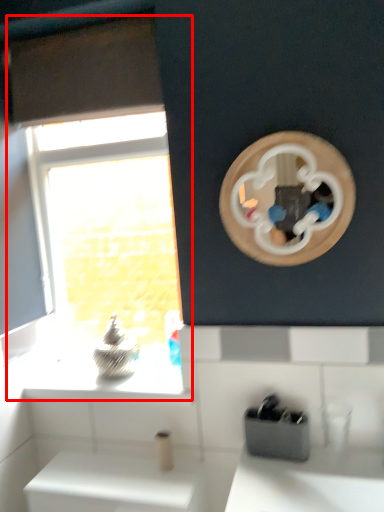
Question: From the image's perspective, where is window (annotated by the red box) located relative to appliance?

Choices:
 (A) below
 (B) above

Answer: (B)